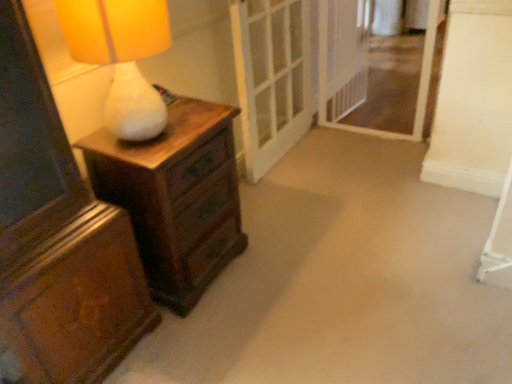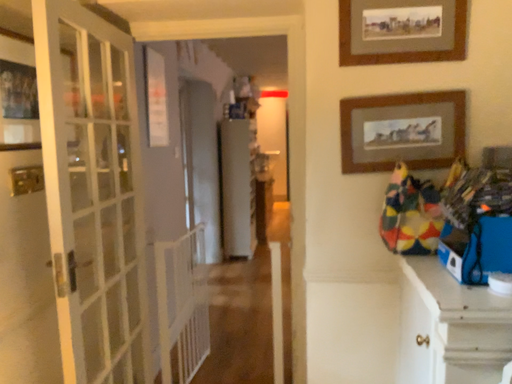
Question: How did the camera likely rotate when shooting the video?

Choices:
 (A) rotated left
 (B) rotated right

Answer: (B)